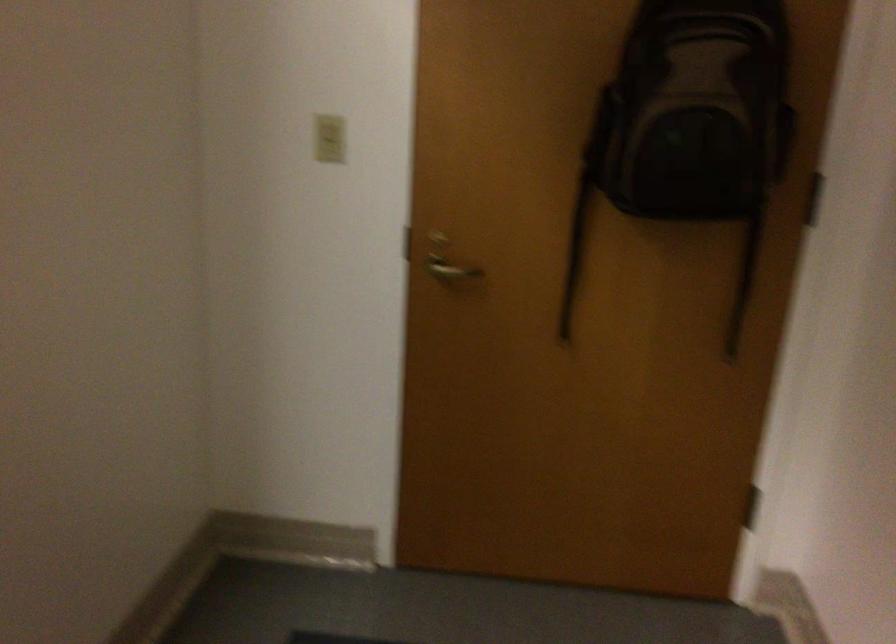
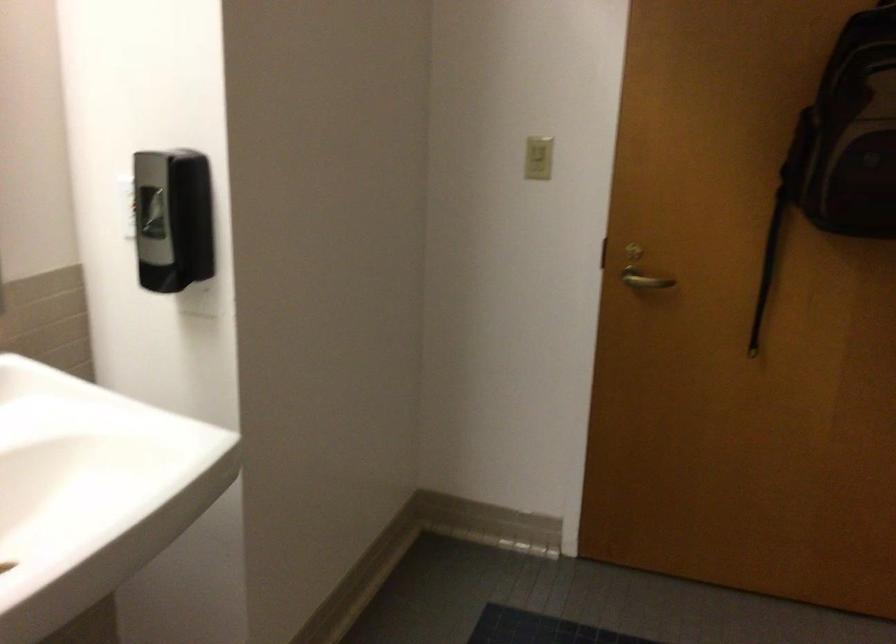
In the second image, find the point that corresponds to pixel 451 267 in the first image.

(643, 279)